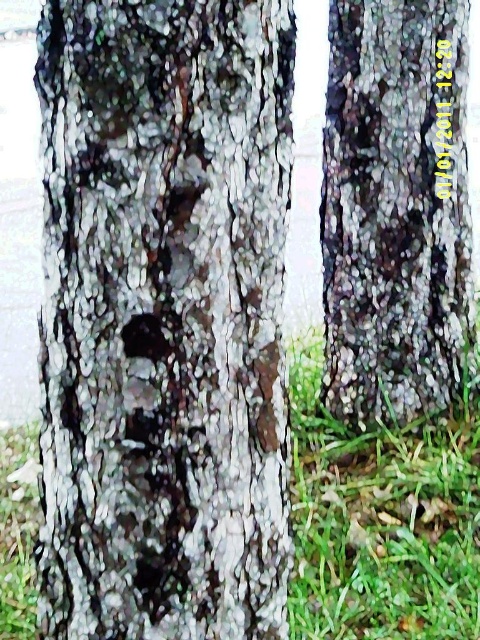
Does dark gray bark tree trunk at center have a lesser width compared to green grass at center?

Indeed, dark gray bark tree trunk at center has a lesser width compared to green grass at center.

Does dark gray bark tree trunk at center have a larger size compared to green grass at center?

Incorrect, dark gray bark tree trunk at center is not larger than green grass at center.

You are a GUI agent. You are given a task and a screenshot of the screen. Output one action in this format:
    pyautogui.click(x=<x>, y=<y>)
    Task: Click on the dark gray bark tree trunk at center
    The height and width of the screenshot is (640, 480).
    Given the screenshot: What is the action you would take?
    pyautogui.click(x=165, y=317)

Image resolution: width=480 pixels, height=640 pixels. What are the coordinates of `dark gray bark tree trunk at center` in the screenshot? It's located at (165, 317).

Can you confirm if dark gray bark tree at right is taller than green grass at center?

Yes.

Is point (398, 109) more distant than point (350, 576)?

Yes, it is.

Locate an element on the screen. This screenshot has height=640, width=480. dark gray bark tree at right is located at coordinates (396, 209).

This screenshot has height=640, width=480. What are the coordinates of `dark gray bark tree trunk at center` in the screenshot? It's located at (165, 317).